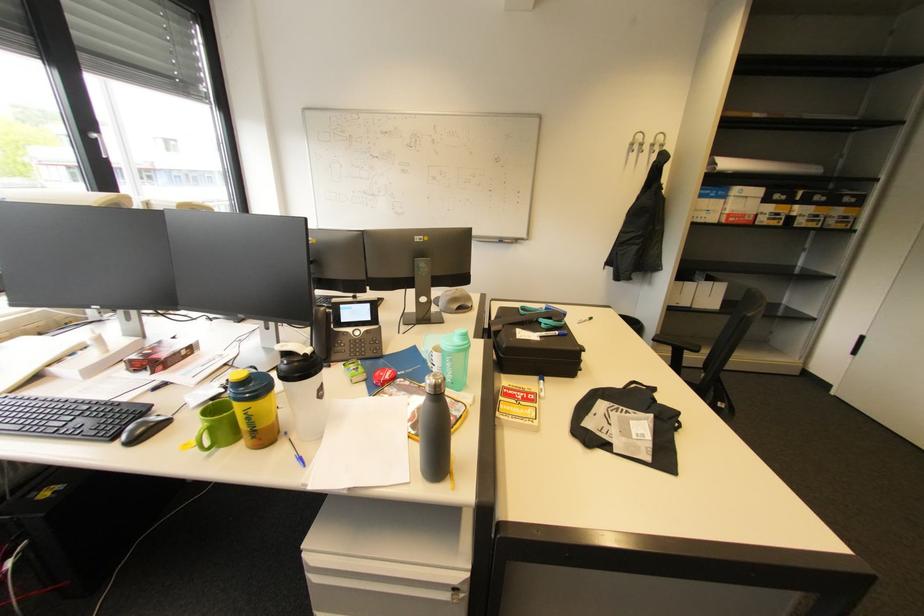
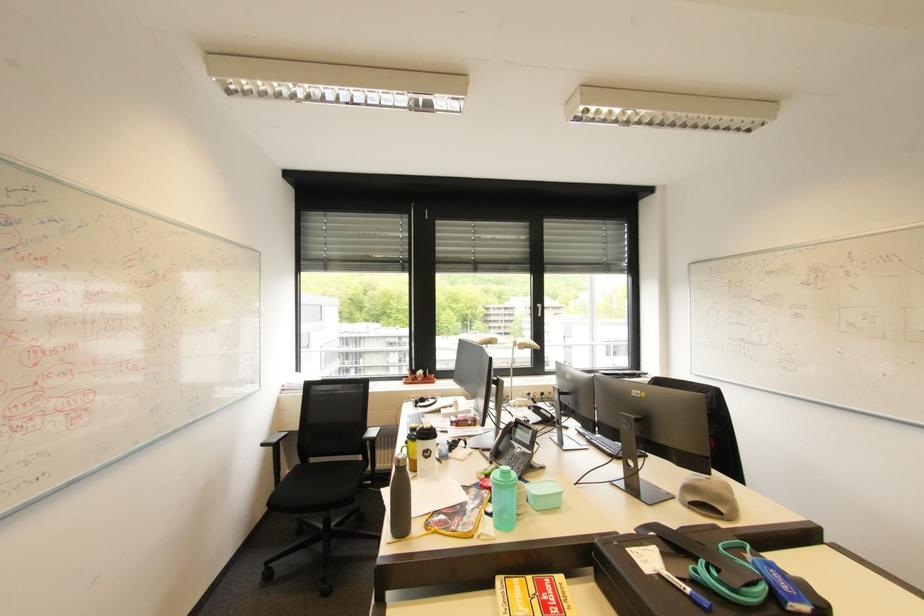
Where in the second image is the point corresponding to point 527,411 from the first image?

(526, 602)